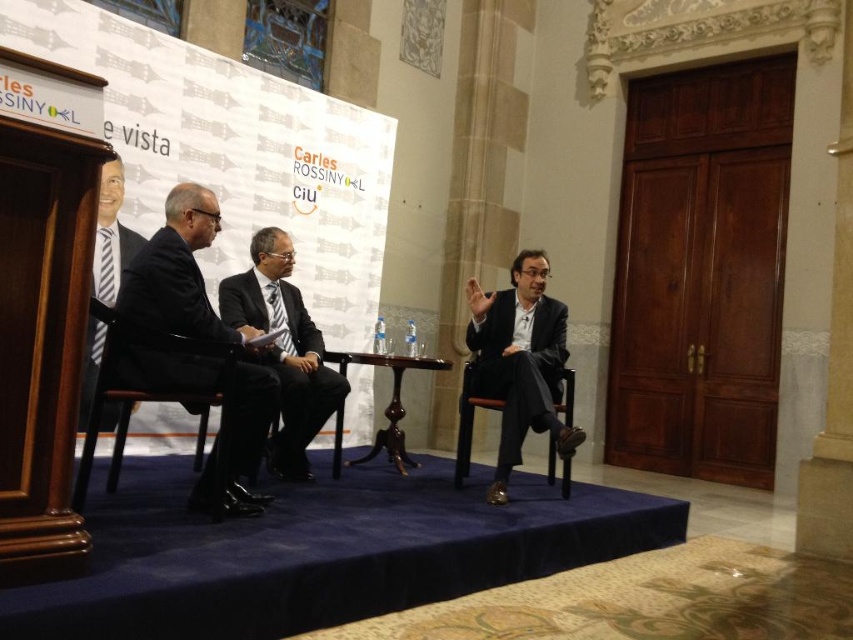
Question: Based on their relative distances, which object is farther from the matte black suit at center?

Choices:
 (A) dark suit at center
 (B) black leather chair at center
 (C) dark wood chair at center
 (D) black leather chair at left

Answer: (D)

Question: Which point appears farthest from the camera in this image?

Choices:
 (A) (339, 426)
 (B) (296, 435)
 (C) (141, 321)
 (D) (473, 317)

Answer: (D)

Question: Does matte black suit at center come in front of dark suit at center?

Choices:
 (A) no
 (B) yes

Answer: (B)

Question: Among these objects, which one is farthest from the camera?

Choices:
 (A) black leather chair at left
 (B) dark wood chair at center

Answer: (B)

Question: From the image, what is the correct spatial relationship of matte black suit at left in relation to dark wood chair at center?

Choices:
 (A) left
 (B) right

Answer: (A)

Question: Is dark suit at left further to camera compared to dark suit at center?

Choices:
 (A) no
 (B) yes

Answer: (A)